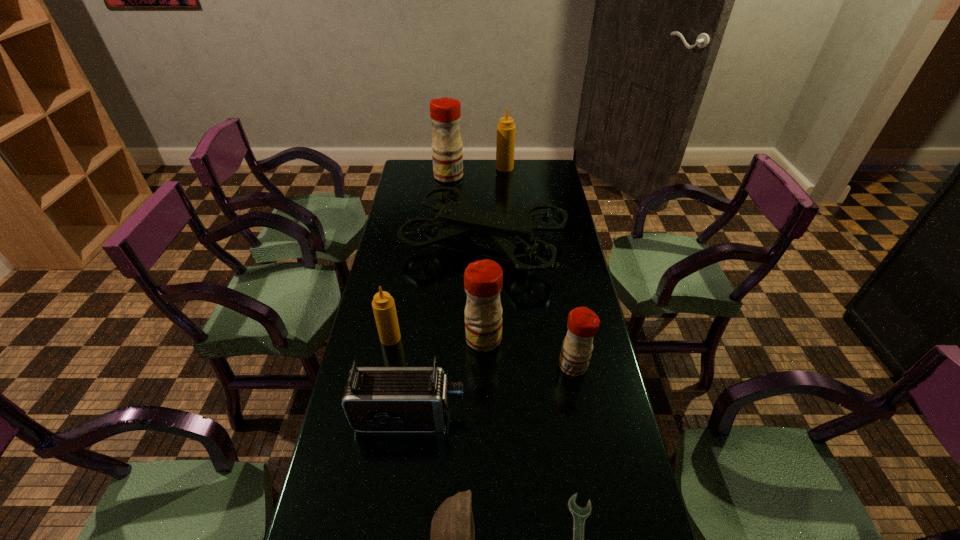
At what (x,y) coordinates should I click in order to perform the action: click on free area in between the farthest red condiment and the third condiment from right to left. Please return your answer as a coordinate pair (x, y). Looking at the image, I should click on (467, 257).

Where is `object that is the sixth closest one to the eighth tallest object`? The width and height of the screenshot is (960, 540). object that is the sixth closest one to the eighth tallest object is located at coordinates (509, 231).

You are a GUI agent. You are given a task and a screenshot of the screen. Output one action in this format:
    pyautogui.click(x=<x>, y=<y>)
    Task: Click on the fourth closest object to the second shortest object
    
    Given the screenshot: What is the action you would take?
    pyautogui.click(x=483, y=279)

Identify the location of condiment identified as the second closest to the wrench. (483, 279).

Find the location of a particular element. This screenshot has height=540, width=960. condiment that is the nearest to the right tan condiment is located at coordinates (445, 113).

Identify which red condiment is located as the second nearest to the drone. Please provide its 2D coordinates. Your answer should be formatted as a tuple, i.e. [(x, y)], where the tuple contains the x and y coordinates of a point satisfying the conditions above.

[(445, 113)]

You are a GUI agent. You are given a task and a screenshot of the screen. Output one action in this format:
    pyautogui.click(x=<x>, y=<y>)
    Task: Click on the red condiment identified as the third closest to the seventh nearest object
    This screenshot has height=540, width=960.
    Given the screenshot: What is the action you would take?
    pyautogui.click(x=583, y=323)

Locate an element on the screen. The width and height of the screenshot is (960, 540). free space that satisfies the following two spatial constraints: 1. on the back side of the smaller tan condiment; 2. on the left side of the drone is located at coordinates (408, 244).